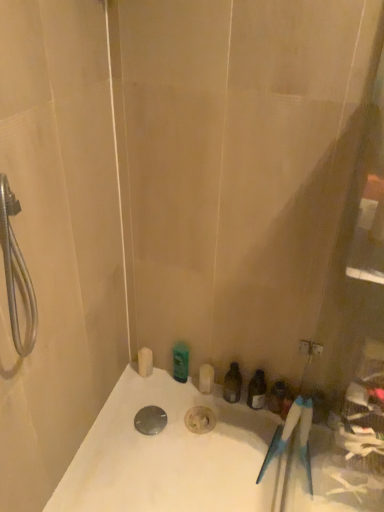
What are the coordinates of `free space in front of polished metallic drain at center` in the screenshot? It's located at (145, 466).